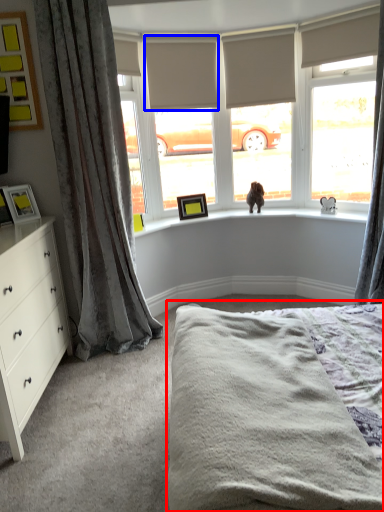
Question: Which object is further to the camera taking this photo, bed (highlighted by a red box) or blind (highlighted by a blue box)?

Choices:
 (A) bed
 (B) blind

Answer: (B)